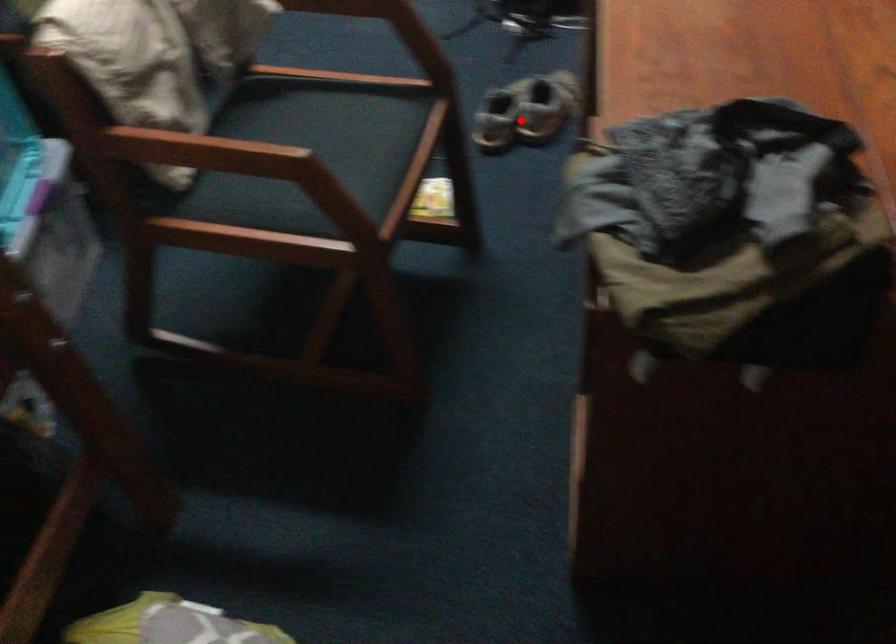
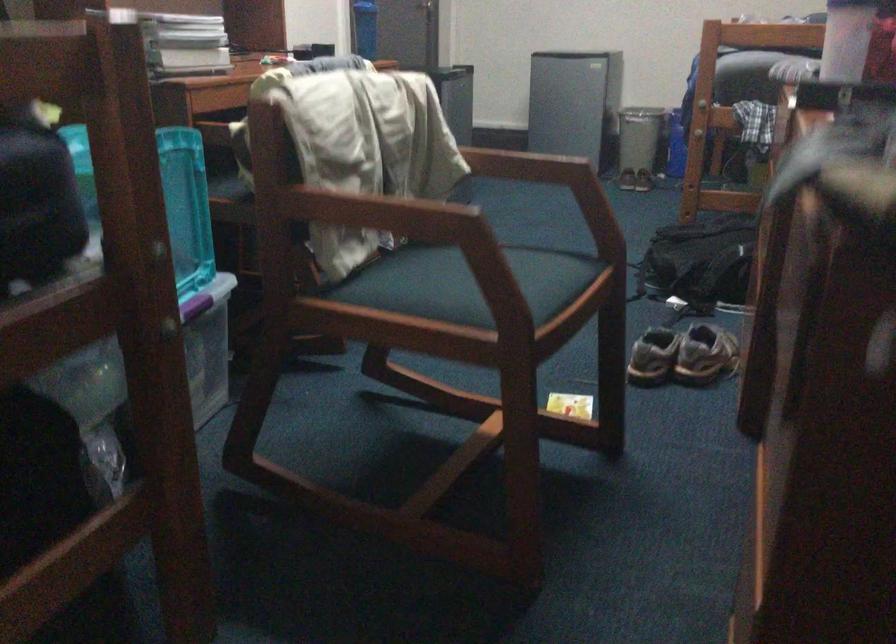
Where in the second image is the point corresponding to the highlighted location from the first image?

(682, 355)